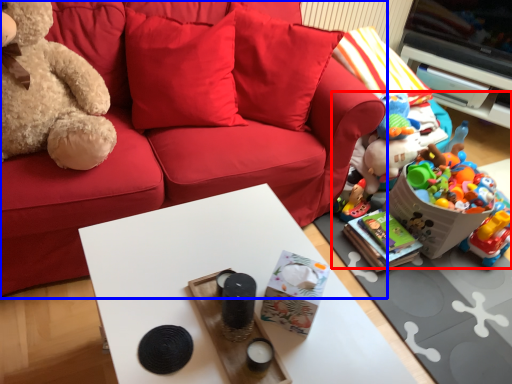
Question: Which of the following is the farthest to the observer, toy (highlighted by a red box) or studio couch (highlighted by a blue box)?

Choices:
 (A) toy
 (B) studio couch

Answer: (A)